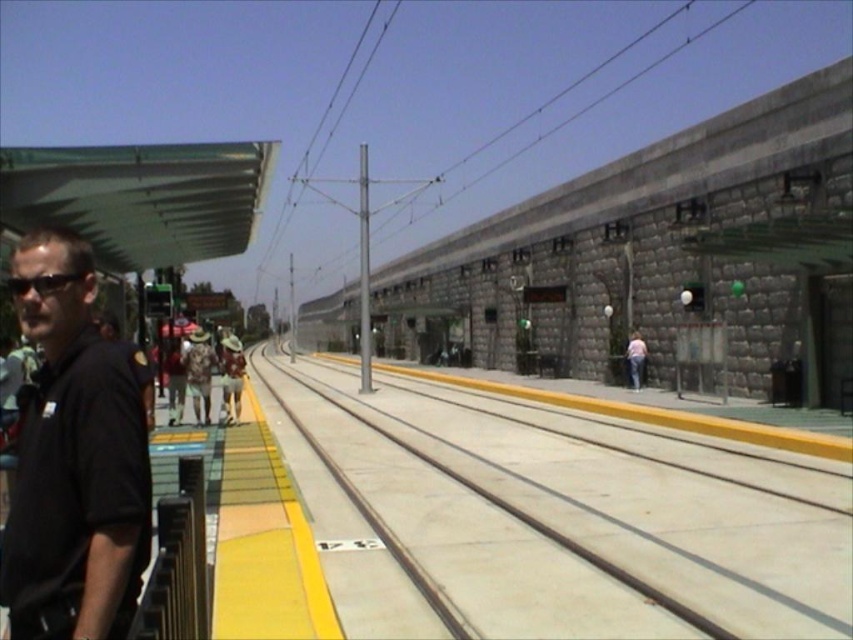
You are a photographer standing on the platform and want to capture both the concrete at center and the gray stone train at center in a single shot. Which object should you frame closer to avoid cropping?

The concrete at center is smaller in size compared to the gray stone train at center, so you should frame the concrete at center closer to avoid cropping.

You are standing on the platform of the train station and want to find the gray stone train at center. According to the coordinates given, where should you look relative to your position?

The gray stone train at center is located at coordinates point (659, 260), which means it is positioned to your lower right direction from your current standing position on the platform.